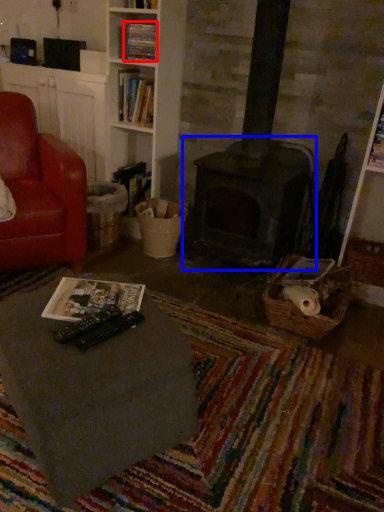
Question: Which point is closer to the camera, book (highlighted by a red box) or fireplace (highlighted by a blue box)?

Choices:
 (A) book
 (B) fireplace

Answer: (A)